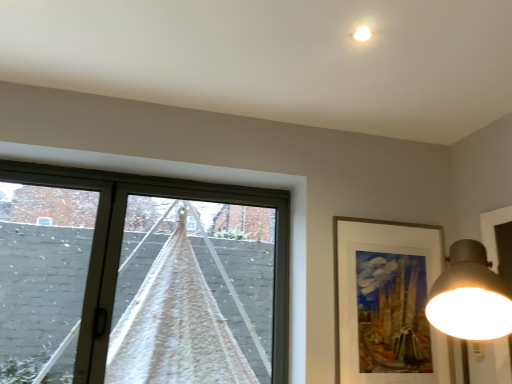
You are a GUI agent. You are given a task and a screenshot of the screen. Output one action in this format:
    pyautogui.click(x=<x>, y=<y>)
    Task: Click on the white textured curtain at left
    The width and height of the screenshot is (512, 384).
    Given the screenshot: What is the action you would take?
    pyautogui.click(x=175, y=327)

This screenshot has width=512, height=384. What do you see at coordinates (175, 327) in the screenshot?
I see `white textured curtain at left` at bounding box center [175, 327].

The image size is (512, 384). I want to click on gold-framed artwork at upper right, so click(387, 302).

In order to face gold-framed artwork at upper right, should I rotate leftwards or rightwards?

Rotate your view right by about 17.891°.

What do you see at coordinates (387, 302) in the screenshot? Image resolution: width=512 pixels, height=384 pixels. I see `gold-framed artwork at upper right` at bounding box center [387, 302].

Identify the location of white textured curtain at left. The image size is (512, 384). (175, 327).

From the picture: Considering the relative positions of white textured curtain at left and gold-framed artwork at upper right in the image provided, is white textured curtain at left to the left or to the right of gold-framed artwork at upper right?

white textured curtain at left is positioned on gold-framed artwork at upper right's left side.

Which is behind, white textured curtain at left or gold-framed artwork at upper right?

gold-framed artwork at upper right is more distant.

Is point (199, 292) more distant than point (388, 341)?

Yes, it is behind point (388, 341).

From the image's perspective, is white textured curtain at left on top of gold-framed artwork at upper right?

Yes, from the image's perspective, white textured curtain at left is over gold-framed artwork at upper right.

From a real-world perspective, is white textured curtain at left under gold-framed artwork at upper right?

No, from a real-world perspective, white textured curtain at left is not below gold-framed artwork at upper right.

Which of these two, white textured curtain at left or gold-framed artwork at upper right, is wider?

With larger width is white textured curtain at left.

Which of these two, white textured curtain at left or gold-framed artwork at upper right, stands taller?

white textured curtain at left.

Is white textured curtain at left smaller than gold-framed artwork at upper right?

No, white textured curtain at left is not smaller than gold-framed artwork at upper right.

Looking at this image, choose the correct answer: Is white textured curtain at left inside gold-framed artwork at upper right or outside it?

The correct answer is: outside.

Is white textured curtain at left not close to gold-framed artwork at upper right?

No, there isn't a large distance between white textured curtain at left and gold-framed artwork at upper right.

Does white textured curtain at left turn towards gold-framed artwork at upper right?

No.

This screenshot has height=384, width=512. What are the coordinates of `curtain positioned vertically above the gold-framed artwork at upper right (from a real-world perspective)` in the screenshot? It's located at (175, 327).

Can you confirm if gold-framed artwork at upper right is positioned to the left of white textured curtain at left?

In fact, gold-framed artwork at upper right is to the right of white textured curtain at left.

Is gold-framed artwork at upper right positioned before white textured curtain at left?

No, gold-framed artwork at upper right is behind white textured curtain at left.

Does point (397, 332) come in front of point (190, 307)?

Yes, point (397, 332) is closer to viewer.

From the image's perspective, would you say gold-framed artwork at upper right is shown under white textured curtain at left?

Correct, gold-framed artwork at upper right appears lower than white textured curtain at left in the image.

From a real-world perspective, is gold-framed artwork at upper right above or below white textured curtain at left?

gold-framed artwork at upper right is below white textured curtain at left.

Is gold-framed artwork at upper right thinner than white textured curtain at left?

Yes, gold-framed artwork at upper right is thinner than white textured curtain at left.

Can you confirm if gold-framed artwork at upper right is shorter than white textured curtain at left?

Yes.

Is gold-framed artwork at upper right bigger than white textured curtain at left?

No, gold-framed artwork at upper right is not bigger than white textured curtain at left.

Is gold-framed artwork at upper right surrounding white textured curtain at left?

No, white textured curtain at left is not surrounded by gold-framed artwork at upper right.

Is gold-framed artwork at upper right placed right next to white textured curtain at left?

No, gold-framed artwork at upper right is not in contact with white textured curtain at left.

Based on the photo, does gold-framed artwork at upper right turn towards white textured curtain at left?

No, gold-framed artwork at upper right is not facing towards white textured curtain at left.

Can you tell me how much gold-framed artwork at upper right and white textured curtain at left differ in facing direction?

gold-framed artwork at upper right and white textured curtain at left are facing 0.461 degrees away from each other.

How far apart are gold-framed artwork at upper right and white textured curtain at left?

The distance of gold-framed artwork at upper right from white textured curtain at left is 31.49 inches.

Where is `curtain that appears in front of the gold-framed artwork at upper right`? Image resolution: width=512 pixels, height=384 pixels. curtain that appears in front of the gold-framed artwork at upper right is located at coordinates (175, 327).

This screenshot has height=384, width=512. Identify the location of curtain on the left side of gold-framed artwork at upper right. (175, 327).

This screenshot has width=512, height=384. Identify the location of curtain that is above the gold-framed artwork at upper right (from a real-world perspective). (175, 327).